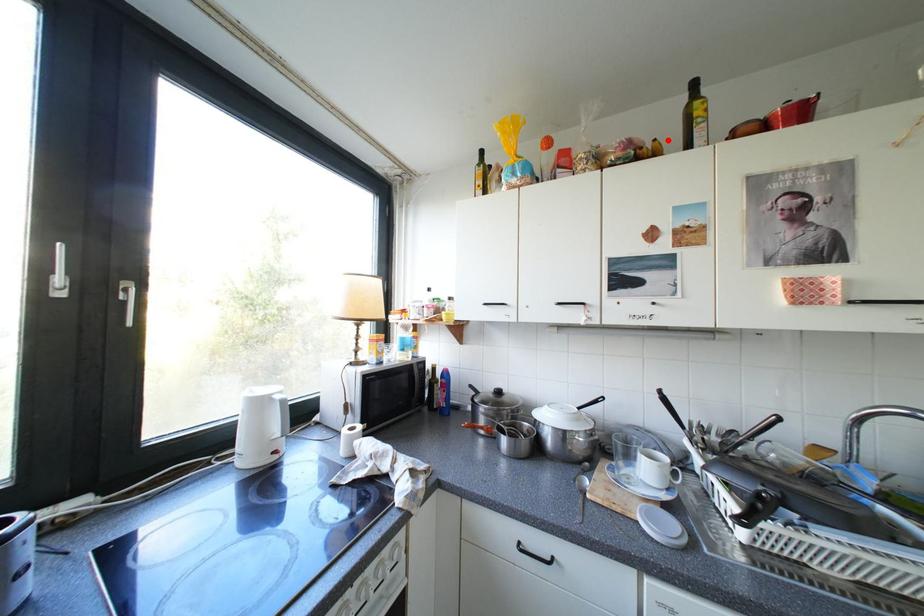
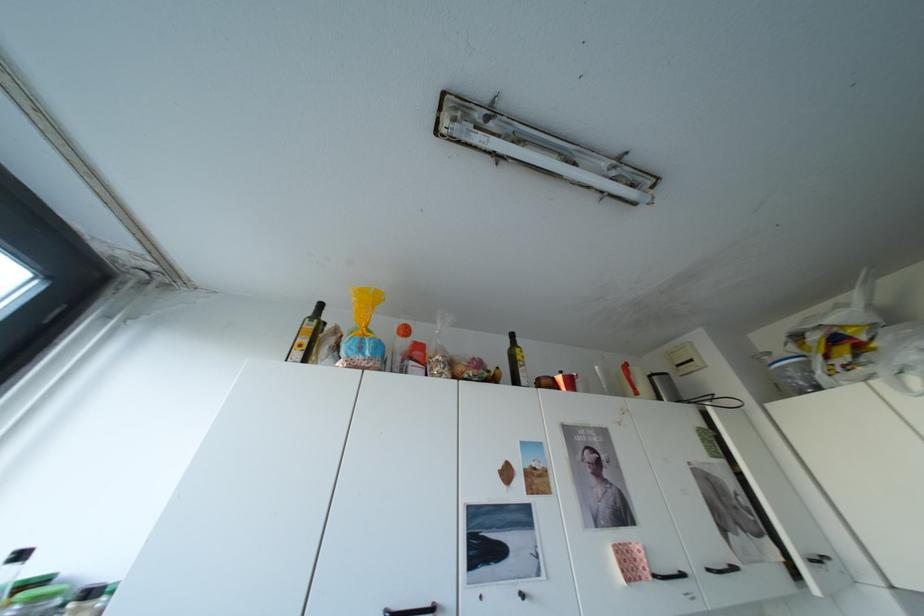
Where in the second image is the point corresponding to the highlighted location from the first image?

(511, 368)